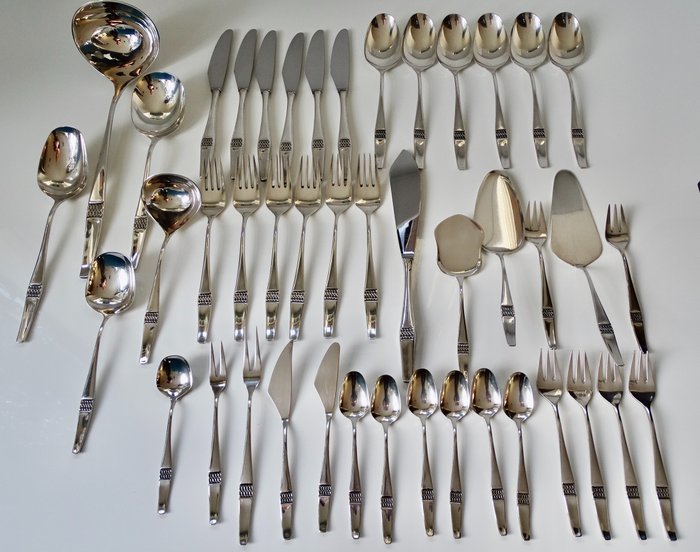
I want to click on forks, so click(x=213, y=211), click(x=246, y=206), click(x=278, y=203), click(x=308, y=203), click(x=337, y=200), click(x=372, y=201).